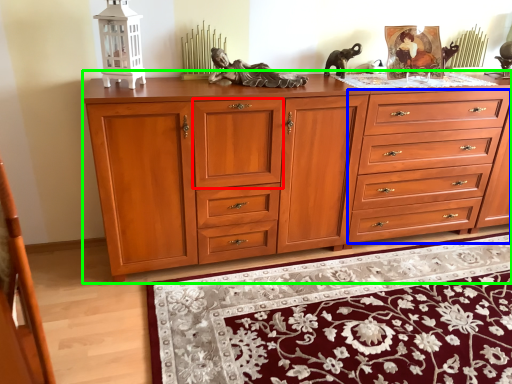
Question: Which is farther away from drawer (highlighted by a red box)? drawer (highlighted by a blue box) or chest of drawers (highlighted by a green box)?

Choices:
 (A) drawer
 (B) chest of drawers

Answer: (A)